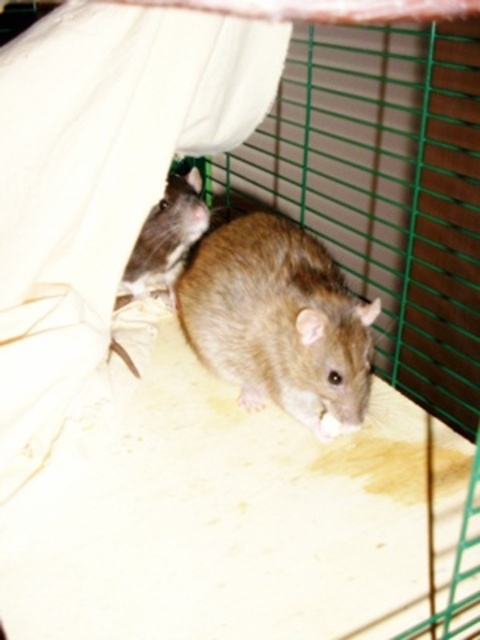
Between point (332, 259) and point (144, 268), which one is positioned in front?

Point (332, 259) is in front.

Describe the element at coordinates (277, 320) in the screenshot. I see `brown furry hamster at center` at that location.

Image resolution: width=480 pixels, height=640 pixels. Identify the location of brown furry hamster at center. (277, 320).